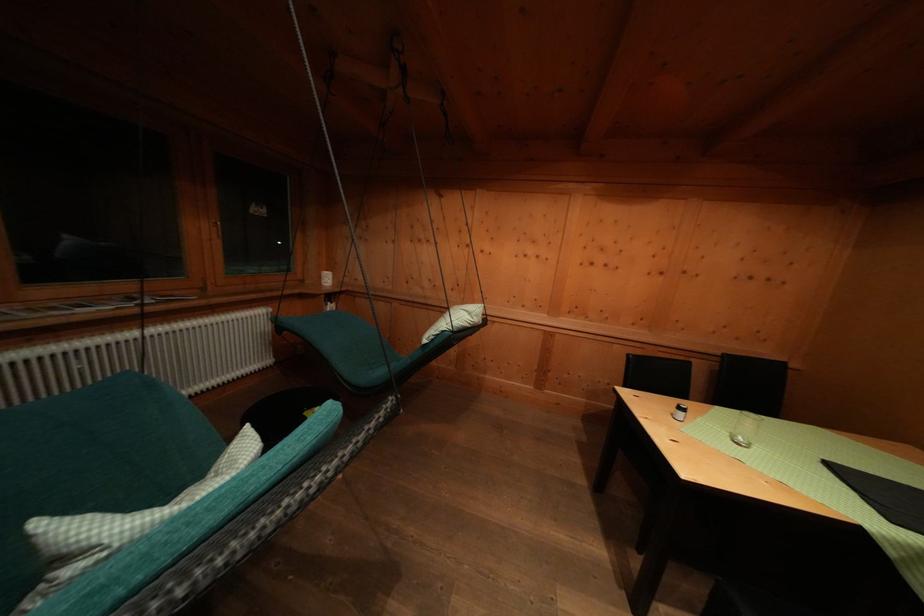
Which object does [94,528] point to?

This point indicates the checkered pillow.